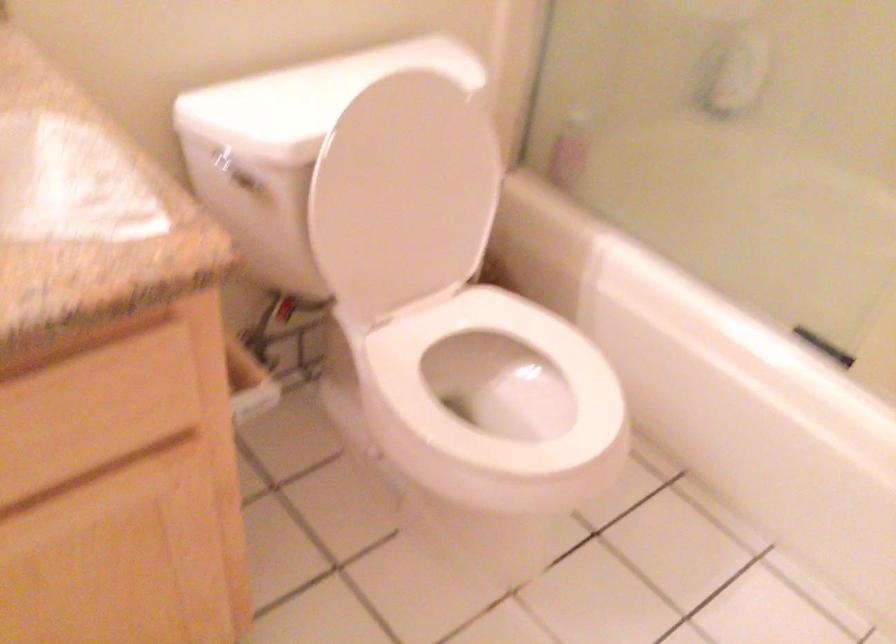
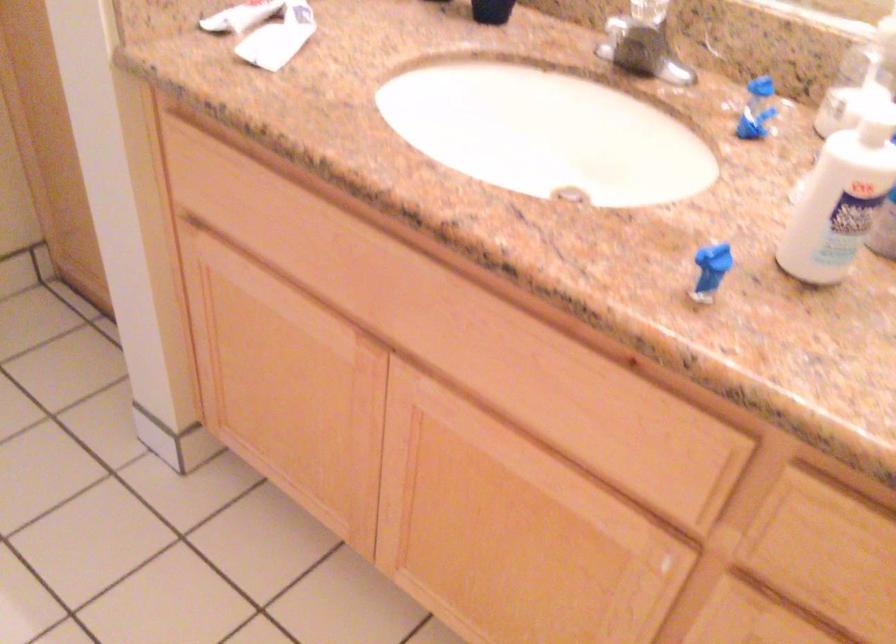
How did the camera likely rotate?

The rotation direction of the camera is left-down.